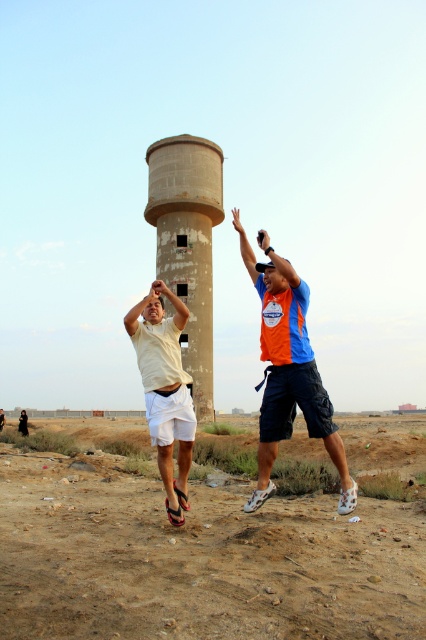
Can you confirm if brown sandy dirt at lower center is taller than concrete water tower at center?

Incorrect, brown sandy dirt at lower center's height is not larger of concrete water tower at center's.

In the scene shown: Between brown sandy dirt at lower center and concrete water tower at center, which one appears on the left side from the viewer's perspective?

Positioned to the left is concrete water tower at center.

You are a GUI agent. You are given a task and a screenshot of the screen. Output one action in this format:
    pyautogui.click(x=<x>, y=<y>)
    Task: Click on the brown sandy dirt at lower center
    This screenshot has height=640, width=426.
    Given the screenshot: What is the action you would take?
    pyautogui.click(x=198, y=560)

Who is higher up, brown sandy dirt at lower center or white matte shorts at center?

white matte shorts at center is above.

Does point (311, 538) lie behind point (157, 358)?

That is False.

Which is behind, point (89, 618) or point (178, 512)?

Positioned behind is point (178, 512).

Find the location of a particular element. This screenshot has width=426, height=640. brown sandy dirt at lower center is located at coordinates (198, 560).

Which is more to the right, brown sandy dirt at lower center or orange fabric shirt at center?

From the viewer's perspective, brown sandy dirt at lower center appears more on the right side.

Who is higher up, brown sandy dirt at lower center or orange fabric shirt at center?

orange fabric shirt at center is above.

Where is `brown sandy dirt at lower center`? The image size is (426, 640). brown sandy dirt at lower center is located at coordinates (198, 560).